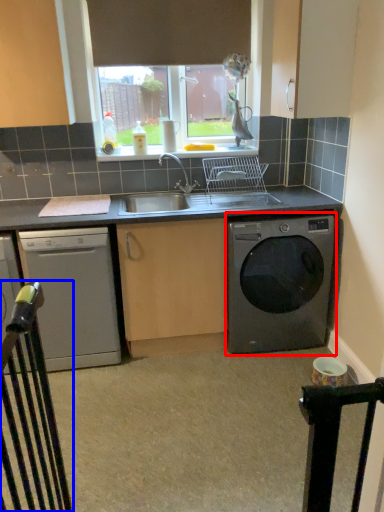
Question: Which object appears farthest to the camera in this image, washing machine (highlighted by a red box) or rail (highlighted by a blue box)?

Choices:
 (A) washing machine
 (B) rail

Answer: (A)